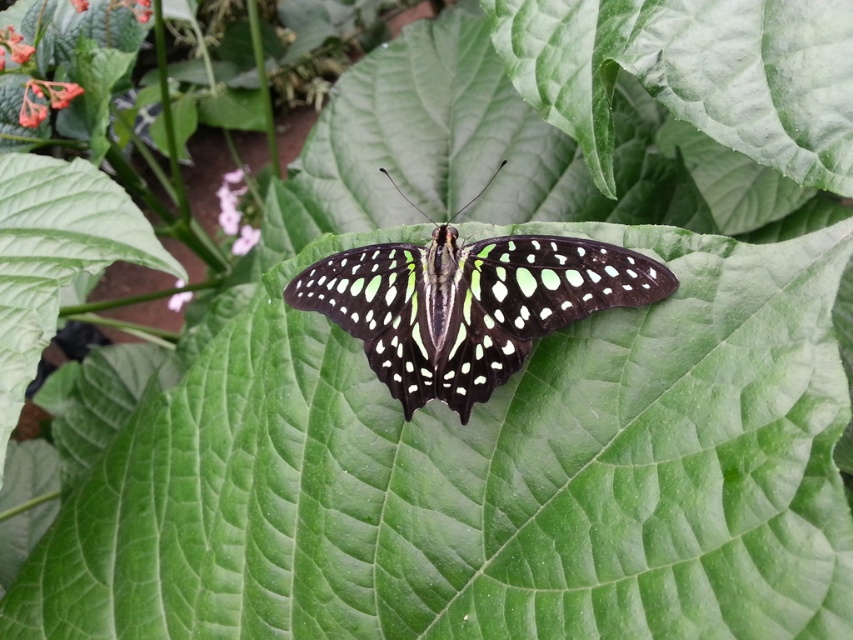
Locate an element on the screen. green glossy butterfly at center is located at coordinates point(468,304).

Is point (358, 321) farther from viewer compared to point (241, 244)?

No, (358, 321) is closer to viewer.

The height and width of the screenshot is (640, 853). What are the coordinates of `green glossy butterfly at center` in the screenshot? It's located at (468, 304).

Is matte purple flower at upper left to the right of pink matte flower at center from the viewer's perspective?

In fact, matte purple flower at upper left is to the left of pink matte flower at center.

Between matte purple flower at upper left and pink matte flower at center, which one has less height?

pink matte flower at center is shorter.

Locate an element on the screen. The image size is (853, 640). matte purple flower at upper left is located at coordinates (236, 211).

Does green glossy butterfly at center appear over matte purple flower at upper left?

No.

Is green glossy butterfly at center below matte purple flower at upper left?

Indeed, green glossy butterfly at center is positioned under matte purple flower at upper left.

Find the location of a particular element. The image size is (853, 640). green glossy butterfly at center is located at coordinates (468, 304).